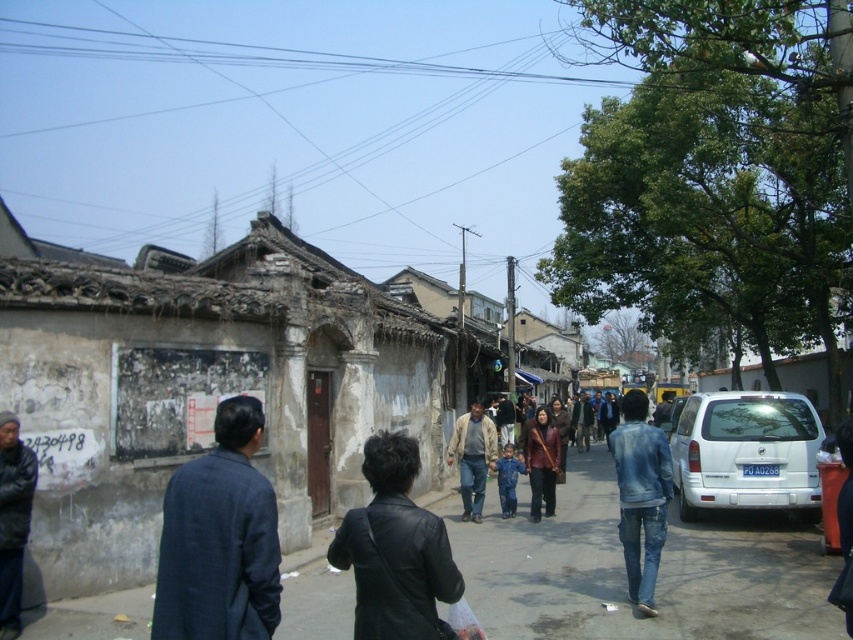
Question: Does dark blue textured jacket at center have a smaller size compared to light brown fabric jacket at center?

Choices:
 (A) yes
 (B) no

Answer: (A)

Question: Does white matte van at right have a greater width compared to matte brown coat at center?

Choices:
 (A) yes
 (B) no

Answer: (A)

Question: Estimate the real-world distances between objects in this image. Which object is farther from the dark blue textured jacket at center?

Choices:
 (A) blue denim pants at center
 (B) black leather jacket at center

Answer: (A)

Question: Considering the real-world distances, which object is closest to the denim jacket at lower right?

Choices:
 (A) black leather jacket at center
 (B) matte brown coat at center

Answer: (B)

Question: Is white matte van at right smaller than dark blue jacket at lower left?

Choices:
 (A) yes
 (B) no

Answer: (B)

Question: Estimate the real-world distances between objects in this image. Which object is closer to the dark blue textured jacket at center?

Choices:
 (A) denim jacket at lower right
 (B) blue denim pants at center

Answer: (A)